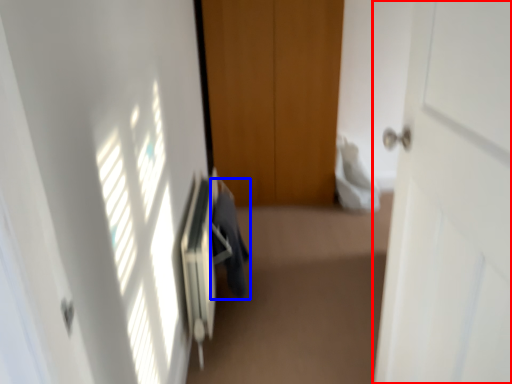
Question: Which object is further to the camera taking this photo, door (highlighted by a red box) or laundry (highlighted by a blue box)?

Choices:
 (A) door
 (B) laundry

Answer: (B)